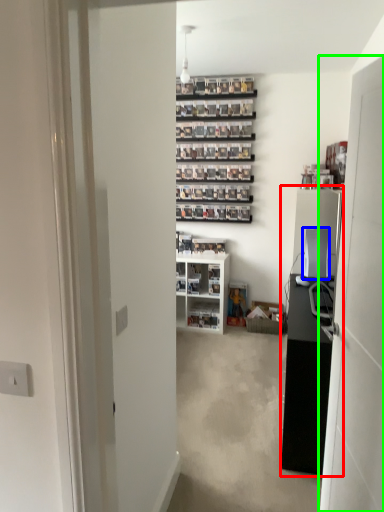
Question: Based on their relative distances, which object is farther from entertainment center (highlighted by a red box)? Choose from appliance (highlighted by a blue box) and door (highlighted by a green box).

Choices:
 (A) appliance
 (B) door

Answer: (B)